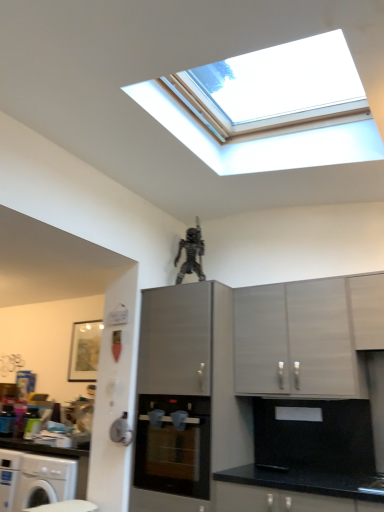
Question: Considering the relative sizes of satin grey cabinet at center, positioned as the third cabinetry in right-to-left order, and matte gray cabinet at center, which appears as the 2th cabinetry when viewed from the right, in the image provided, is satin grey cabinet at center, positioned as the third cabinetry in right-to-left order, thinner than matte gray cabinet at center, which appears as the 2th cabinetry when viewed from the right,?

Choices:
 (A) no
 (B) yes

Answer: (A)

Question: Considering the relative positions of satin grey cabinet at center, positioned as the third cabinetry in right-to-left order, and matte gray cabinet at center, which appears as the 2th cabinetry when viewed from the right, in the image provided, is satin grey cabinet at center, positioned as the third cabinetry in right-to-left order, in front of matte gray cabinet at center, which appears as the 2th cabinetry when viewed from the right,?

Choices:
 (A) yes
 (B) no

Answer: (A)

Question: From the image's perspective, is satin grey cabinet at center, the 1th cabinetry positioned from the left, located above matte gray cabinet at center, which appears as the 2th cabinetry when viewed from the right?

Choices:
 (A) no
 (B) yes

Answer: (A)

Question: Is matte gray cabinet at center, the second cabinetry positioned from the left, inside satin grey cabinet at center, the 1th cabinetry positioned from the left?

Choices:
 (A) yes
 (B) no

Answer: (B)

Question: Would you say satin grey cabinet at center, the 1th cabinetry positioned from the left, is a long distance from matte gray cabinet at center, which appears as the 2th cabinetry when viewed from the right?

Choices:
 (A) no
 (B) yes

Answer: (A)

Question: Would you say metallic figure at upper center is to the left or to the right of matte gray cabinet at center, the second cabinetry positioned from the left, in the picture?

Choices:
 (A) right
 (B) left

Answer: (B)

Question: Would you say metallic figure at upper center is inside or outside matte gray cabinet at center, which appears as the 2th cabinetry when viewed from the right?

Choices:
 (A) outside
 (B) inside

Answer: (A)

Question: Considering the positions of metallic figure at upper center and matte gray cabinet at center, the second cabinetry positioned from the left, in the image, is metallic figure at upper center wider or thinner than matte gray cabinet at center, the second cabinetry positioned from the left,?

Choices:
 (A) thin
 (B) wide

Answer: (A)

Question: From the image's perspective, is metallic figure at upper center above or below matte gray cabinet at center, the second cabinetry positioned from the left?

Choices:
 (A) above
 (B) below

Answer: (A)

Question: Is matte black oven at center taller or shorter than metallic figure at upper center?

Choices:
 (A) tall
 (B) short

Answer: (A)

Question: From a real-world perspective, relative to metallic figure at upper center, is matte black oven at center vertically above or below?

Choices:
 (A) above
 (B) below

Answer: (B)

Question: Would you say matte black oven at center is to the left or to the right of metallic figure at upper center in the picture?

Choices:
 (A) left
 (B) right

Answer: (B)

Question: Is point (145, 453) positioned closer to the camera than point (198, 241)?

Choices:
 (A) closer
 (B) farther

Answer: (A)

Question: Is point (355, 290) closer or farther from the camera than point (349, 322)?

Choices:
 (A) farther
 (B) closer

Answer: (A)

Question: Considering the relative positions of white matte cabinet at upper right, the first cabinetry from the right, and matte gray cabinet at center, which appears as the 2th cabinetry when viewed from the right, in the image provided, is white matte cabinet at upper right, the first cabinetry from the right, to the left or to the right of matte gray cabinet at center, which appears as the 2th cabinetry when viewed from the right,?

Choices:
 (A) right
 (B) left

Answer: (A)